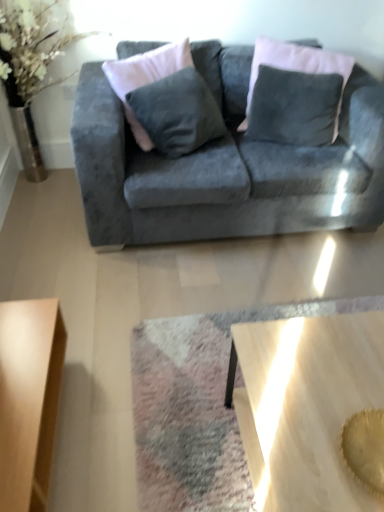
Locate an element on the screen. The image size is (384, 512). free space in front of velvet gray couch at center is located at coordinates pyautogui.click(x=201, y=315).